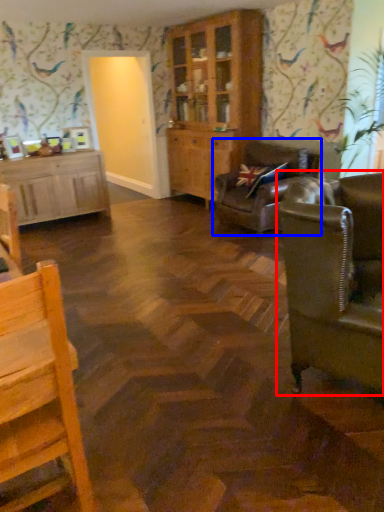
Question: Which of the following is the farthest to the observer, studio couch (highlighted by a red box) or studio couch (highlighted by a blue box)?

Choices:
 (A) studio couch
 (B) studio couch

Answer: (B)